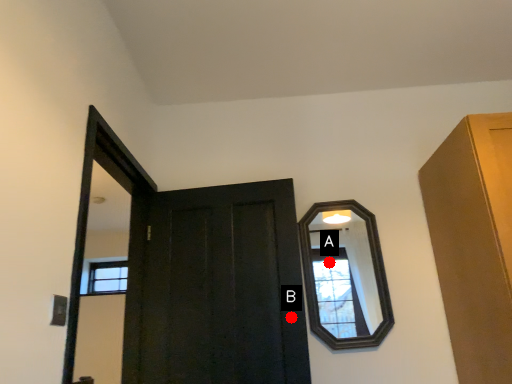
Question: Two points are circled on the image, labeled by A and B beside each circle. Which of the following is the farthest from the observer?

Choices:
 (A) A is further
 (B) B is further

Answer: (A)